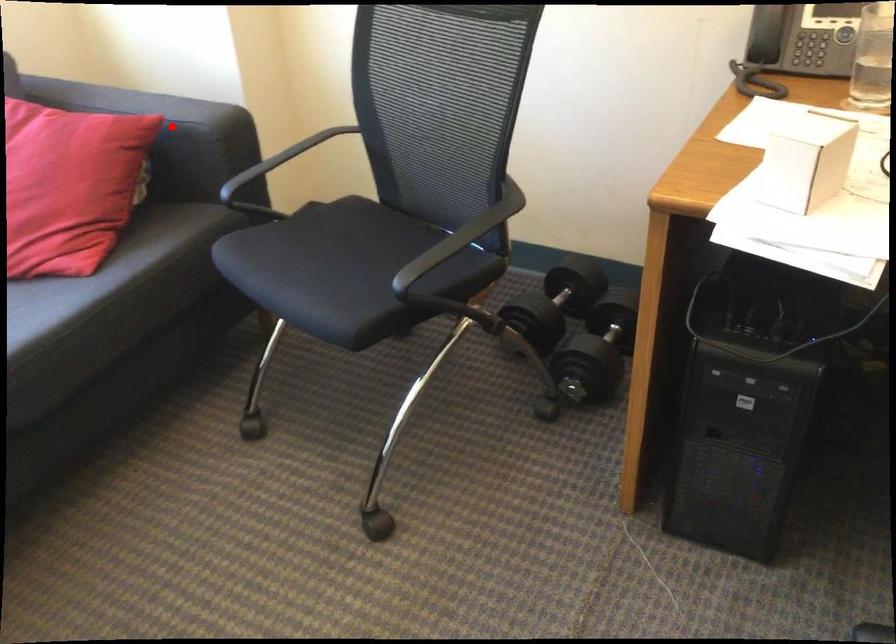
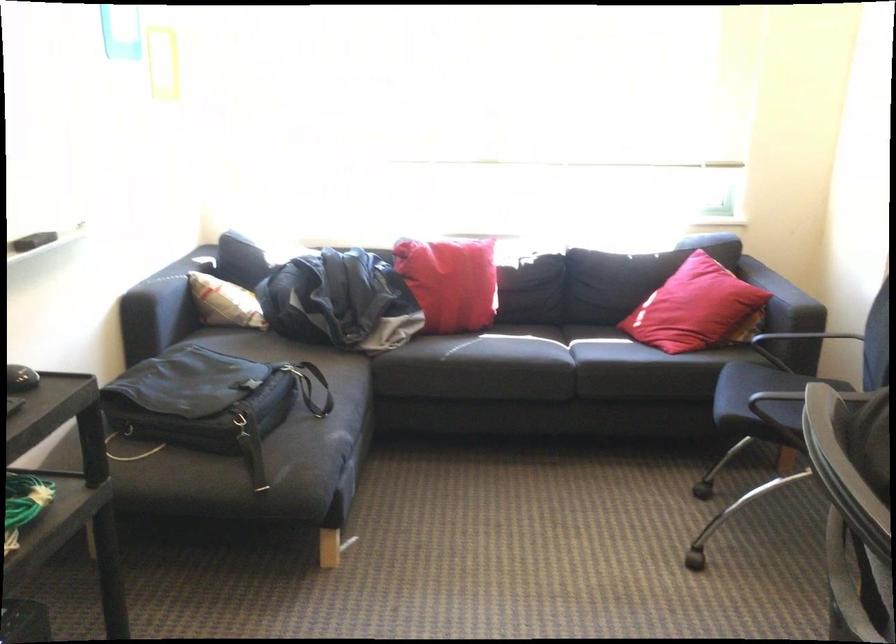
Find the pixel in the second image that matches the highlighted location in the first image.

(782, 298)